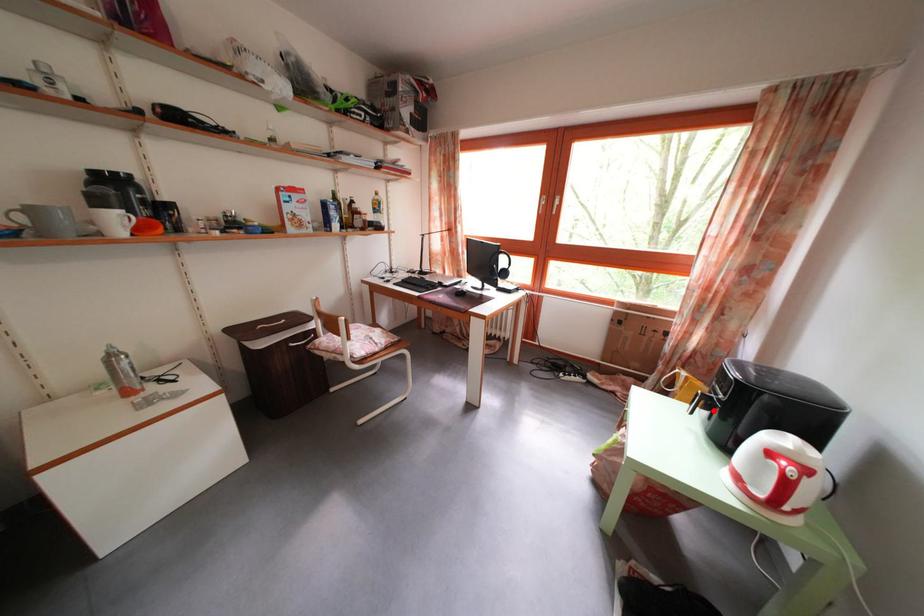
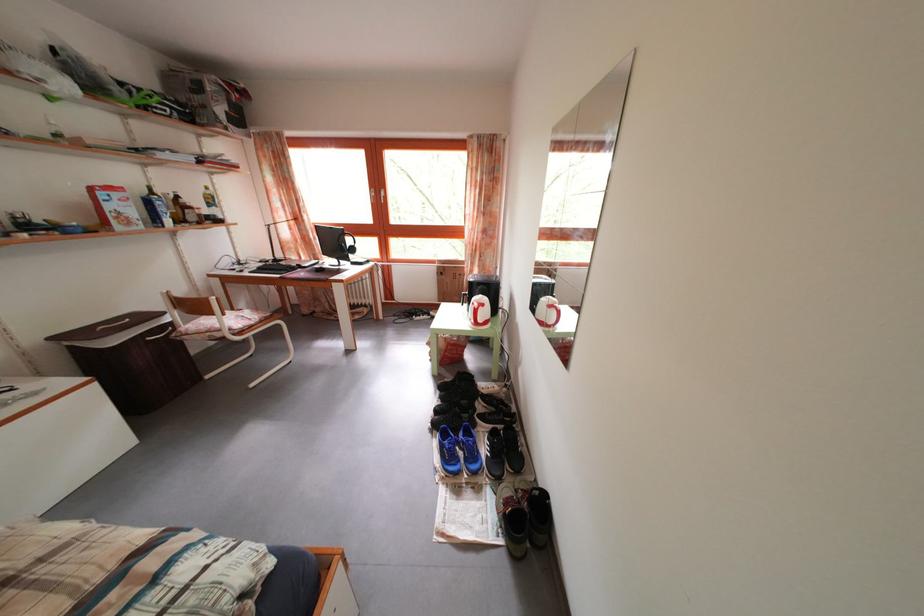
Question: I am providing you with two images of the same scene from different viewpoints. A red point is marked on the first image. Can you still see the location of the red point in image 2?

Choices:
 (A) Yes
 (B) No

Answer: (B)